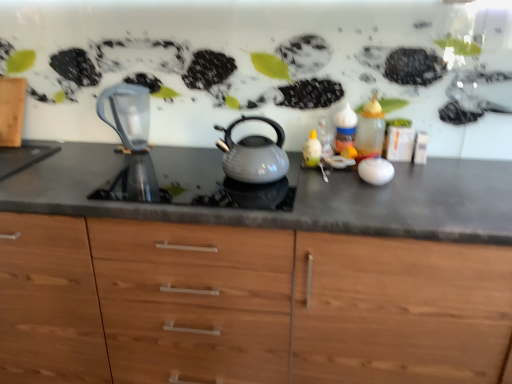
Question: Relative to matte gray countertop at center, is translucent glass bottle at right in front or behind?

Choices:
 (A) behind
 (B) front

Answer: (A)

Question: Is translucent glass bottle at right bigger or smaller than matte gray countertop at center?

Choices:
 (A) small
 (B) big

Answer: (A)

Question: Estimate the real-world distances between objects in this image. Which object is farther from the matte gray kettle at center?

Choices:
 (A) matte gray countertop at center
 (B) transparent glass jug at left
 (C) translucent glass bottle at right

Answer: (A)

Question: Which is nearer to the transparent glass jug at left?

Choices:
 (A) matte gray countertop at center
 (B) translucent glass bottle at right
 (C) matte gray kettle at center

Answer: (C)